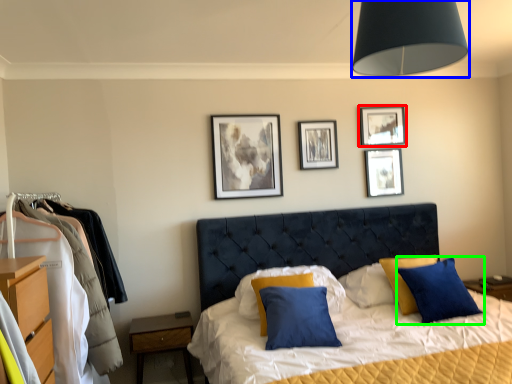
Question: Which object is positioned farthest from picture frame (highlighted by a red box)? Select from light fixture (highlighted by a blue box) and pillow (highlighted by a green box).

Choices:
 (A) light fixture
 (B) pillow

Answer: (A)